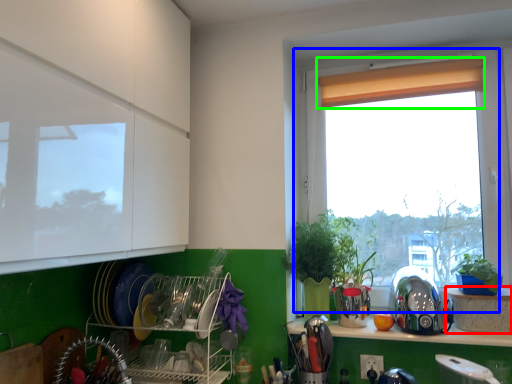
Question: Estimate the real-world distances between objects in this image. Which object is farther from cabinetry (highlighted by a red box), window (highlighted by a blue box) or curtain (highlighted by a green box)?

Choices:
 (A) window
 (B) curtain

Answer: (B)